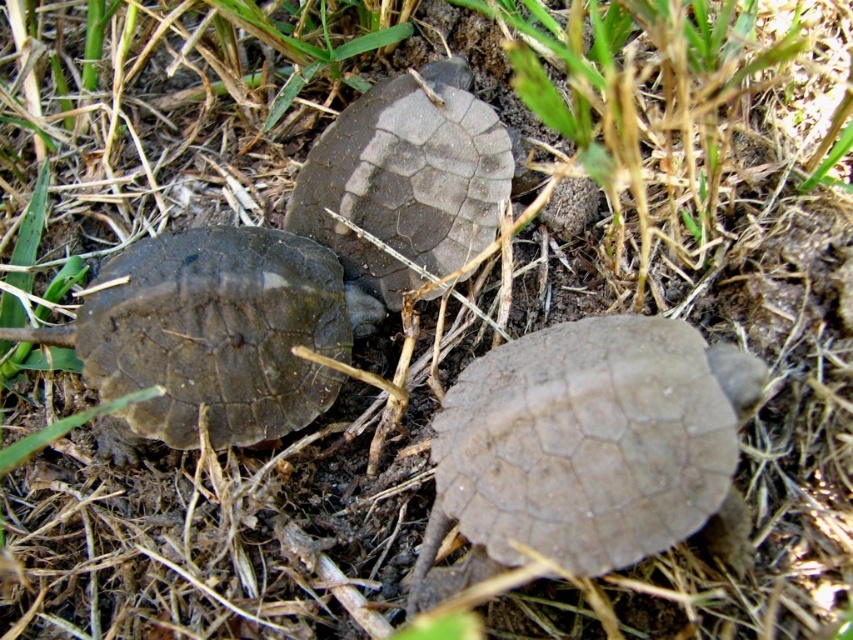
You are a researcher studying the spatial distribution of baby turtles in their natural habitat. You observe the image and note the location of the matte brown tortoise shell at center. Can you provide the coordinates of this turtle in the image?

The coordinates of the matte brown tortoise shell at center are at point (402,186).

You are a wildlife photographer aiming to capture a closeup of the matte brown tortoise shell at center and the matte brown tortoise at left. Given that your camera lens has a maximum width coverage of 15 cm, can you fit both subjects into the frame without moving the camera?

The matte brown tortoise shell at center is wider than the matte brown tortoise at left. However, since the exact widths aren